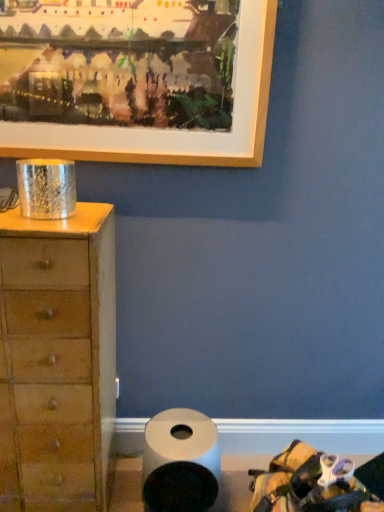
The width and height of the screenshot is (384, 512). Find the location of `white matte toilet paper at lower center`. white matte toilet paper at lower center is located at coordinates (180, 462).

What do you see at coordinates (180, 462) in the screenshot? I see `white matte toilet paper at lower center` at bounding box center [180, 462].

What is the approximate height of white matte toilet paper at lower center?

white matte toilet paper at lower center is 13.39 inches in height.

Measure the distance between point (x=167, y=428) and camera.

They are 4.97 feet apart.

I want to click on white matte toilet paper at lower center, so click(x=180, y=462).